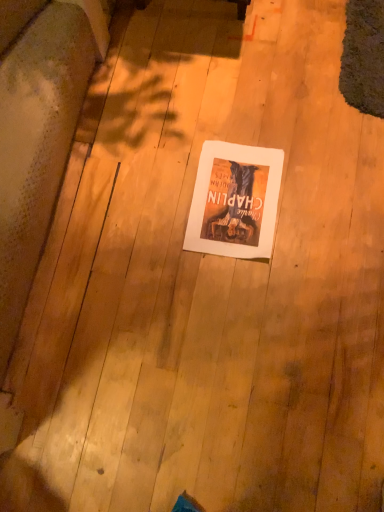
You are a GUI agent. You are given a task and a screenshot of the screen. Output one action in this format:
    pyautogui.click(x=<x>, y=<y>)
    Task: Click on the unoccupied area in front of white paper poster at center
    Image resolution: width=384 pixels, height=512 pixels.
    Given the screenshot: What is the action you would take?
    pyautogui.click(x=255, y=296)